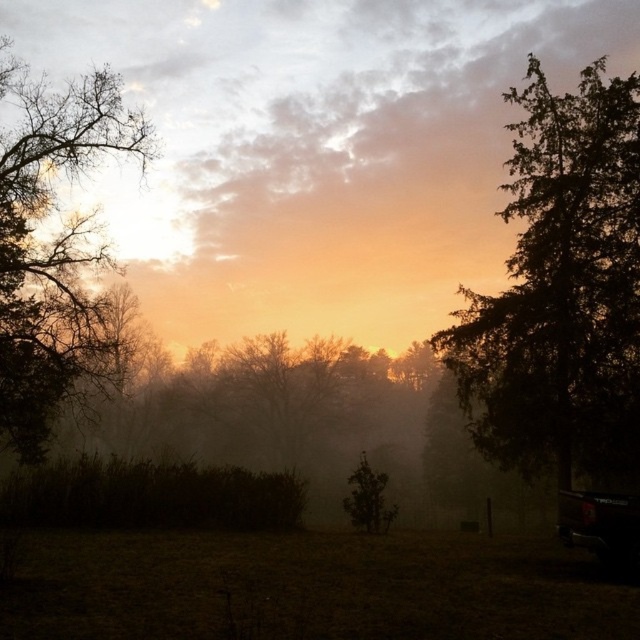
I want to click on bare branches at left, so click(x=52, y=248).

Who is taller, black matte truck at lower right or green matte tree at center?

green matte tree at center is taller.

Which is in front, point (634, 561) or point (372, 520)?

Positioned in front is point (634, 561).

Image resolution: width=640 pixels, height=640 pixels. What do you see at coordinates (602, 525) in the screenshot? I see `black matte truck at lower right` at bounding box center [602, 525].

Where is `black matte truck at lower right`? Image resolution: width=640 pixels, height=640 pixels. black matte truck at lower right is located at coordinates (602, 525).

The image size is (640, 640). What do you see at coordinates (314, 150) in the screenshot?
I see `foggy mist at center` at bounding box center [314, 150].

Does point (180, 52) come closer to viewer compared to point (570, 538)?

That is False.

Identify the location of foggy mist at center. (314, 150).